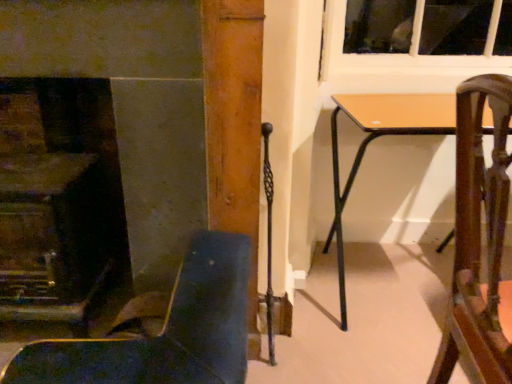
Question: Is light brown wooden table at center behind wooden chair at right, placed as the first chair when sorted from right to left?

Choices:
 (A) yes
 (B) no

Answer: (A)

Question: Is light brown wooden table at center not near wooden chair at right, the second chair viewed from the left?

Choices:
 (A) no
 (B) yes

Answer: (A)

Question: Does light brown wooden table at center have a lesser height compared to wooden chair at right, the second chair viewed from the left?

Choices:
 (A) yes
 (B) no

Answer: (A)

Question: From the image's perspective, is light brown wooden table at center located beneath wooden chair at right, placed as the first chair when sorted from right to left?

Choices:
 (A) yes
 (B) no

Answer: (B)

Question: Is light brown wooden table at center outside wooden chair at right, the second chair viewed from the left?

Choices:
 (A) yes
 (B) no

Answer: (A)

Question: Does light brown wooden table at center have a greater width compared to wooden chair at right, the second chair viewed from the left?

Choices:
 (A) yes
 (B) no

Answer: (A)

Question: Can you confirm if light brown wooden table at center is thinner than leather-like dark blue chair at lower left, marked as the 1th chair in a left-to-right arrangement?

Choices:
 (A) yes
 (B) no

Answer: (B)

Question: Could leather-like dark blue chair at lower left, placed as the second chair when sorted from right to left, be considered to be inside light brown wooden table at center?

Choices:
 (A) yes
 (B) no

Answer: (B)

Question: Can you confirm if light brown wooden table at center is positioned to the left of leather-like dark blue chair at lower left, placed as the second chair when sorted from right to left?

Choices:
 (A) yes
 (B) no

Answer: (B)

Question: Can you confirm if light brown wooden table at center is shorter than leather-like dark blue chair at lower left, marked as the 1th chair in a left-to-right arrangement?

Choices:
 (A) no
 (B) yes

Answer: (A)

Question: Is light brown wooden table at center further to the viewer compared to leather-like dark blue chair at lower left, marked as the 1th chair in a left-to-right arrangement?

Choices:
 (A) no
 (B) yes

Answer: (B)

Question: Is light brown wooden table at center facing away from leather-like dark blue chair at lower left, placed as the second chair when sorted from right to left?

Choices:
 (A) yes
 (B) no

Answer: (B)

Question: Can you confirm if wooden chair at right, the second chair viewed from the left, is positioned to the right of smooth stone fireplace at left?

Choices:
 (A) no
 (B) yes

Answer: (B)